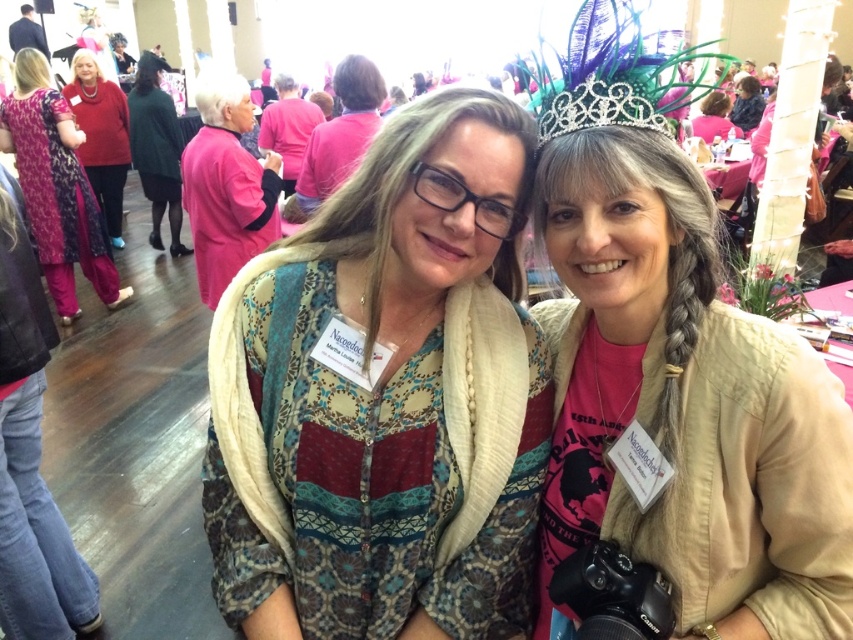
You are organizing a fashion show and need to decide which item to display first based on their sizes. The patterned fabric scarf at center and the pink satin dress at upper center are both candidates. According to their sizes, which should be displayed first if you want to start with the smaller item?

The patterned fabric scarf at center should be displayed first because its width is less than the pink satin dress at upper center, making it the smaller item.

You are a photographer at the event and need to capture a clear shot of both the patterned fabric scarf at center and the pink satin dress at upper center. Which object should you focus on first to ensure it appears larger in the photo?

The patterned fabric scarf at center has a greater height compared to the pink satin dress at upper center, so you should focus on the patterned fabric scarf at center first to ensure it appears larger in the photo.